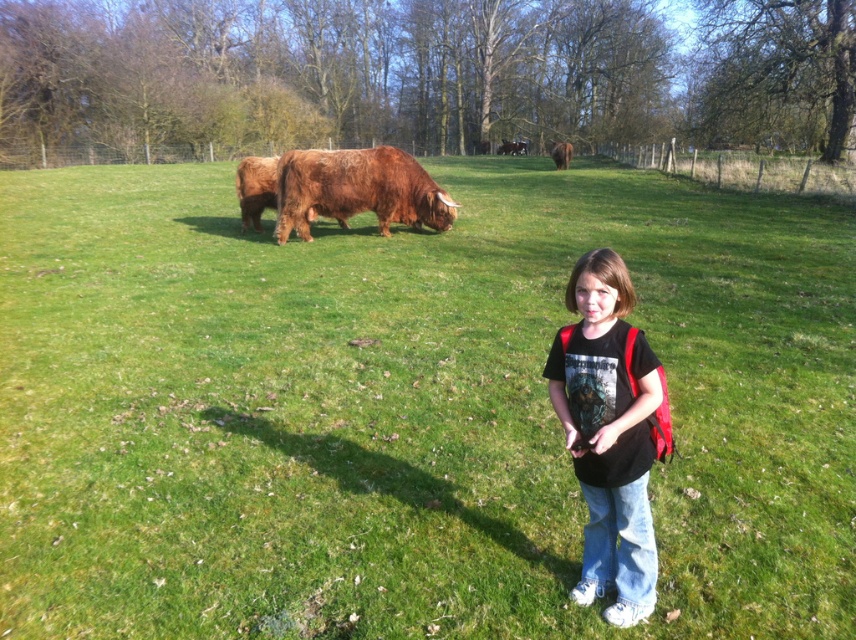
Who is shorter, brown furry yak at center or brown fuzzy yak at center?

brown fuzzy yak at center

Which is above, brown furry yak at center or brown fuzzy yak at center?

brown fuzzy yak at center

Who is more distant from viewer, (342,157) or (265,173)?

The point (265,173) is behind.

Find the location of a particular element. This screenshot has height=640, width=856. brown furry yak at center is located at coordinates (357, 189).

Does brown fuzzy yak at center have a larger size compared to brown fuzzy yak at upper center?

Incorrect, brown fuzzy yak at center is not larger than brown fuzzy yak at upper center.

This screenshot has width=856, height=640. What are the coordinates of `brown fuzzy yak at center` in the screenshot? It's located at (254, 188).

Who is positioned more to the right, black matte shirt at center or brown fuzzy yak at upper center?

Positioned to the right is brown fuzzy yak at upper center.

Who is more distant from viewer, (629, 547) or (568, 145)?

The point (568, 145) is more distant.

Is point (638, 440) behind point (556, 156)?

No, (638, 440) is closer to viewer.

Where is `black matte shirt at center`? black matte shirt at center is located at coordinates (608, 433).